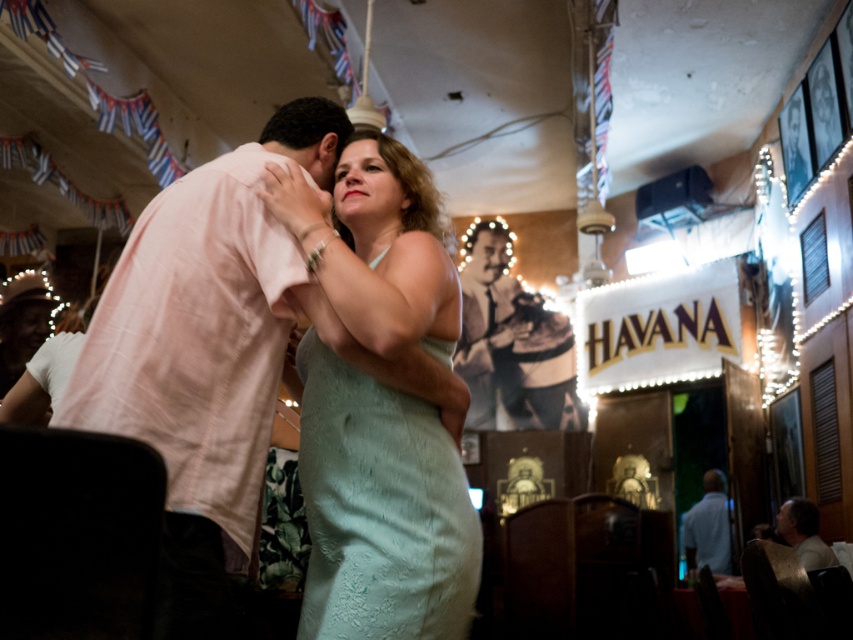
Question: Does light pink cotton shirt at center appear on the left side of light brown leather jacket at lower right?

Choices:
 (A) yes
 (B) no

Answer: (A)

Question: Is light pink cotton shirt at center to the right of mint lace dress at center from the viewer's perspective?

Choices:
 (A) no
 (B) yes

Answer: (A)

Question: Which object is closer to the camera taking this photo?

Choices:
 (A) light brown leather jacket at lower right
 (B) light pink cotton shirt at center

Answer: (B)

Question: Which point appears farthest from the camera in this image?

Choices:
 (A) (778, 515)
 (B) (244, 424)

Answer: (A)

Question: Considering the real-world distances, which object is closest to the white shirt at lower right?

Choices:
 (A) light pink cotton shirt at center
 (B) light brown leather jacket at lower right
 (C) mint lace dress at center

Answer: (B)

Question: Does mint lace dress at center have a lesser width compared to light brown leather jacket at lower right?

Choices:
 (A) yes
 (B) no

Answer: (B)